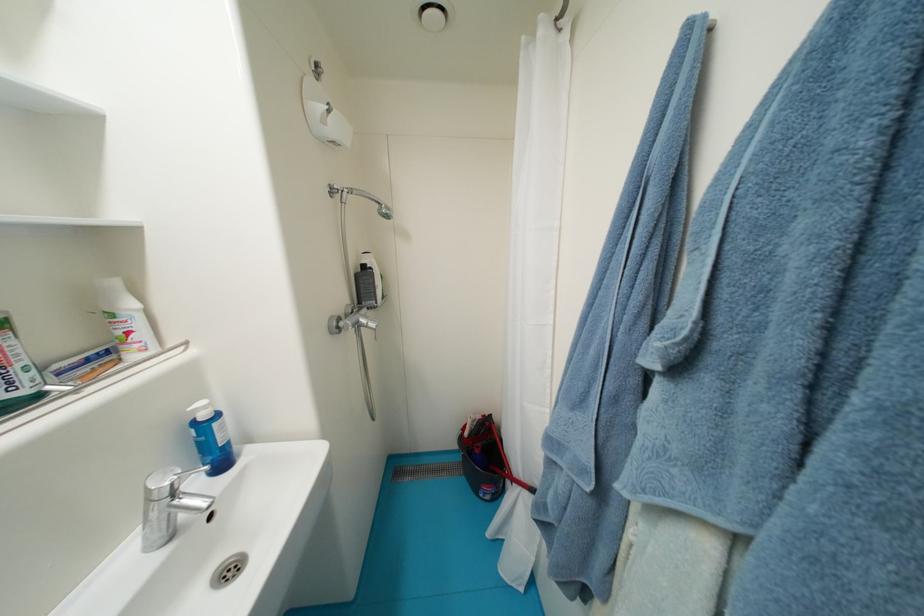
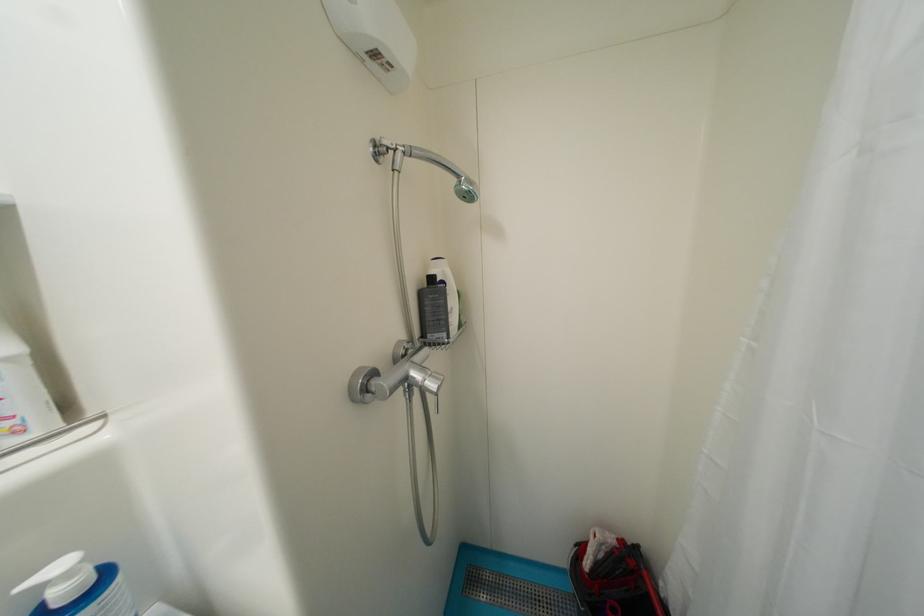
Question: The camera is either moving clockwise (left) or counter-clockwise (right) around the object. The first image is from the beginning of the video and the second image is from the end. Is the camera moving left or right when shooting the video?

Choices:
 (A) Left
 (B) Right

Answer: (B)